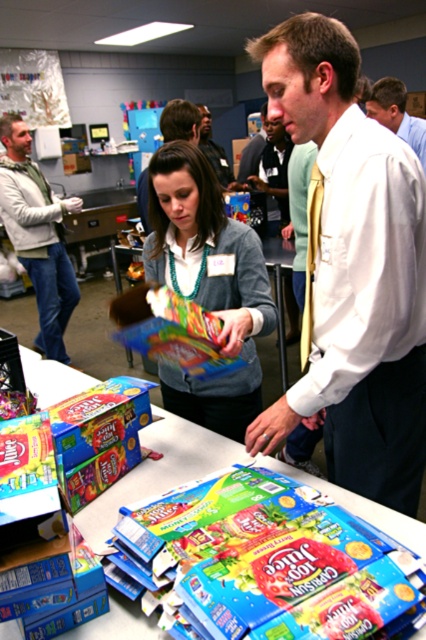
What object is located at the coordinates point (37, 234)?

The point (37, 234) corresponds to the matte white sweater at center.

You are a photographer trying to capture a group photo of the people at the table. You notice the white shirt at upper center and the matte black shirt at center. Which person should you ask to move forward slightly to ensure both are in focus?

The white shirt at upper center is shorter than the matte black shirt at center, so you should ask the person in the white shirt at upper center to move forward slightly to ensure both are in focus.